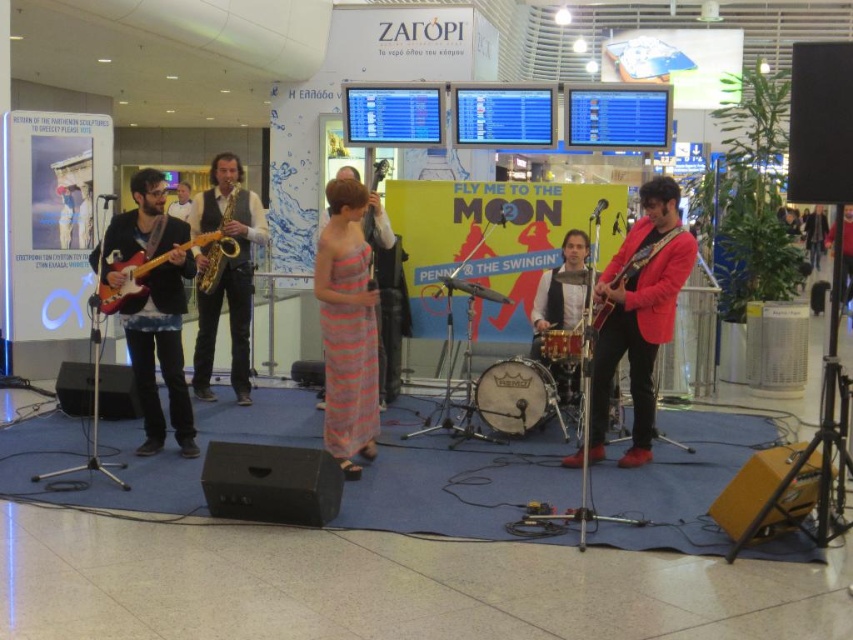
You are a photographer positioned at the entrance of the airport terminal. You want to capture a photo of the pink striped dress at center from the best possible angle. Considering the stage setup, where should you position yourself to ensure the dress is centered in your frame?

To center the pink striped dress at center in your frame, position yourself directly in front of the stage at the midpoint between the stage edges, as the dress is located at coordinates approximately 0.511 on the x and 0.408 on the y axis, which is near the center of the stage.

What are the coordinates of the matte wood electric guitar at left?

The coordinates of the matte wood electric guitar at left are at point (152, 268).

What is located at the coordinates point (152, 268)?

At point (152, 268) lies matte wood electric guitar at left.